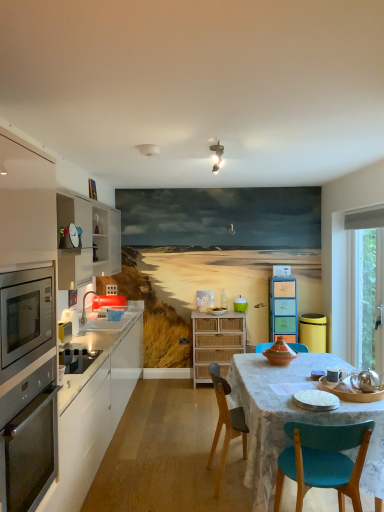
Question: Is wooden chair at center positioned beyond the bounds of metallic microwave at center-left, positioned as the 4th appliance in front-to-back order?

Choices:
 (A) no
 (B) yes

Answer: (B)

Question: Does wooden chair at center have a lesser width compared to metallic microwave at center-left, which is the second appliance from right to left?

Choices:
 (A) no
 (B) yes

Answer: (A)

Question: From a real-world perspective, is wooden chair at center below metallic microwave at center-left, which is the second appliance from right to left?

Choices:
 (A) yes
 (B) no

Answer: (A)

Question: Could you tell me if wooden chair at center is turned towards metallic microwave at center-left, which is the second appliance from right to left?

Choices:
 (A) yes
 (B) no

Answer: (B)

Question: Can you confirm if wooden chair at center is bigger than metallic microwave at center-left, marked as the first appliance in a back-to-front arrangement?

Choices:
 (A) no
 (B) yes

Answer: (B)

Question: From a real-world perspective, is wooden chair at center physically above metallic microwave at center-left, marked as the first appliance in a back-to-front arrangement?

Choices:
 (A) yes
 (B) no

Answer: (B)

Question: From a real-world perspective, is transparent glass window at right under white glossy sink at left?

Choices:
 (A) no
 (B) yes

Answer: (A)

Question: Is transparent glass window at right further to the viewer compared to white glossy sink at left?

Choices:
 (A) no
 (B) yes

Answer: (A)

Question: Is white glossy sink at left completely or partially inside transparent glass window at right?

Choices:
 (A) no
 (B) yes

Answer: (A)

Question: Can you confirm if transparent glass window at right is wider than white glossy sink at left?

Choices:
 (A) yes
 (B) no

Answer: (B)

Question: Can you confirm if transparent glass window at right is positioned to the left of white glossy sink at left?

Choices:
 (A) yes
 (B) no

Answer: (B)

Question: Does transparent glass window at right lie in front of white glossy sink at left?

Choices:
 (A) yes
 (B) no

Answer: (A)

Question: Can you confirm if metallic microwave at center-left, which appears as the fourth appliance when ordered from the bottom, is thinner than pastel wood drawers at center, the 3th cabinetry in the left-to-right sequence?

Choices:
 (A) yes
 (B) no

Answer: (A)